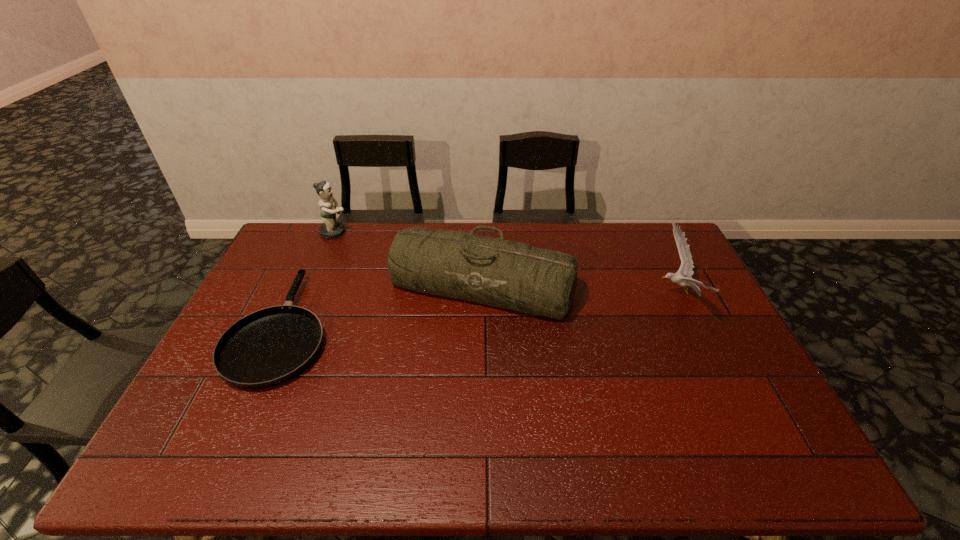
Where is `vacant space at the far edge`? This screenshot has width=960, height=540. vacant space at the far edge is located at coordinates (388, 248).

Locate an element on the screen. The image size is (960, 540). free location at the near edge of the desktop is located at coordinates point(387,438).

At what (x,y) coordinates should I click in order to perform the action: click on blank space at the left edge. Please return your answer as a coordinate pair (x, y). The width and height of the screenshot is (960, 540). Looking at the image, I should click on (275, 282).

The height and width of the screenshot is (540, 960). I want to click on blank space at the right edge of the desktop, so click(x=712, y=389).

Locate an element on the screen. This screenshot has height=540, width=960. vacant space at the far right corner is located at coordinates (640, 239).

Image resolution: width=960 pixels, height=540 pixels. Find the location of `unoccupied area between the second object from right to left and the frying pan`. unoccupied area between the second object from right to left and the frying pan is located at coordinates (382, 307).

Locate an element on the screen. The width and height of the screenshot is (960, 540). vacant area between the gull and the shortest object is located at coordinates (480, 311).

Find the location of `free area in between the farthest object and the frying pan`. free area in between the farthest object and the frying pan is located at coordinates (309, 280).

Locate an element on the screen. free space that is in between the third object from left to right and the rightmost object is located at coordinates (580, 290).

The height and width of the screenshot is (540, 960). I want to click on blank region between the gull and the third object from left to right, so click(580, 290).